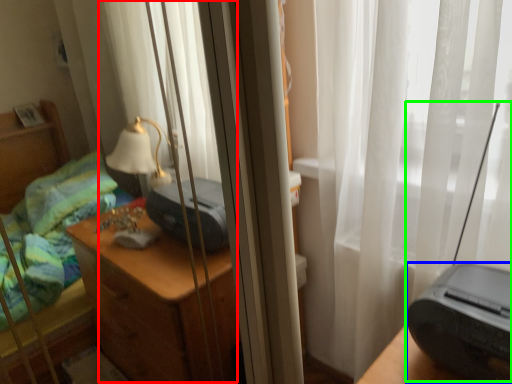
Question: Estimate the real-world distances between objects in this image. Which object is closer to curtain (highlighted by a red box), printer (highlighted by a blue box) or equipment (highlighted by a green box)?

Choices:
 (A) printer
 (B) equipment

Answer: (B)